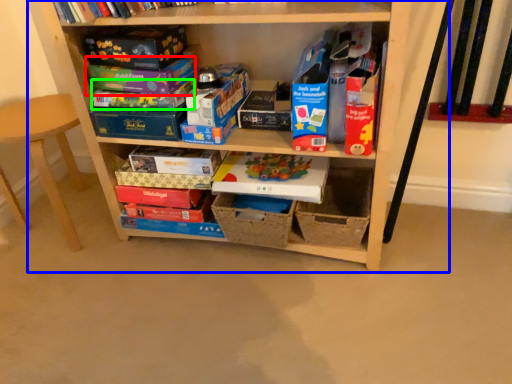
Question: Estimate the real-world distances between objects in this image. Which object is farther from paperback book (highlighted by a red box), shelf (highlighted by a blue box) or paperback book (highlighted by a green box)?

Choices:
 (A) shelf
 (B) paperback book

Answer: (A)